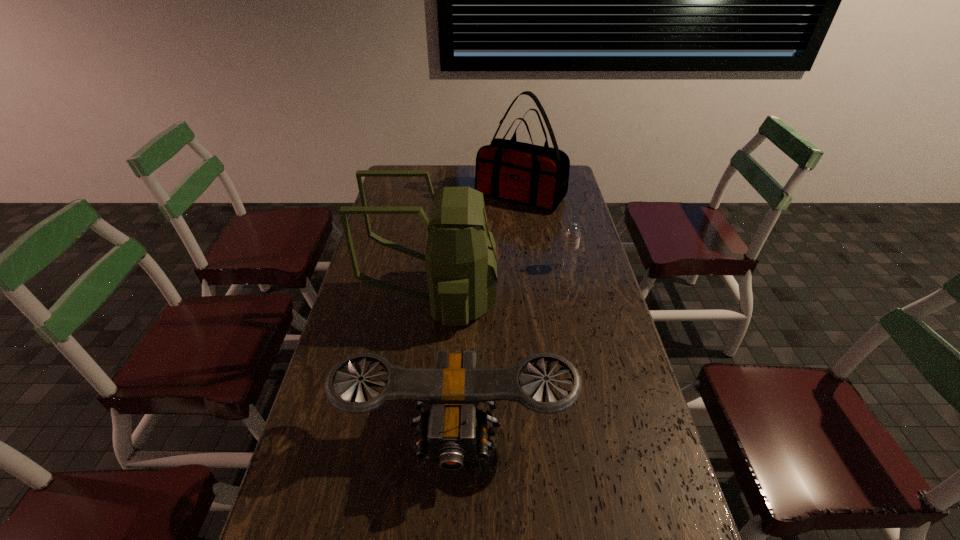
Select which object appears as the third closest to the duffel bag. Please provide its 2D coordinates. Your answer should be formatted as a tuple, i.e. [(x, y)], where the tuple contains the x and y coordinates of a point satisfying the conditions above.

[(453, 426)]

Choose which object is the second nearest neighbor to the shortest object. Please provide its 2D coordinates. Your answer should be formatted as a tuple, i.e. [(x, y)], where the tuple contains the x and y coordinates of a point satisfying the conditions above.

[(537, 176)]

At what (x,y) coordinates should I click in order to perform the action: click on vacant space that satisfies the following two spatial constraints: 1. on the front side of the duffel bag; 2. on the left side of the shortest object. Please return your answer as a coordinate pair (x, y). This screenshot has height=540, width=960. Looking at the image, I should click on (530, 267).